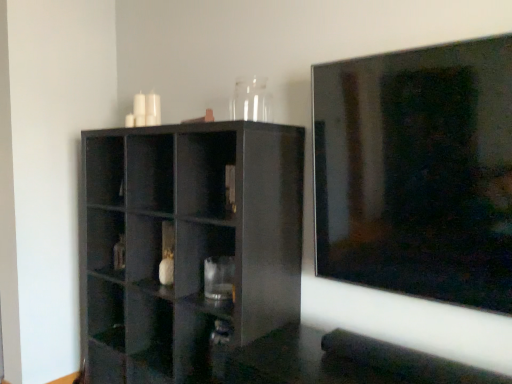
In order to face glossy black shelf at center, should I rotate leftwards or rightwards?

To face it directly, rotate left by 10.112 degrees.

The width and height of the screenshot is (512, 384). Find the location of `glossy black shelf at center`. glossy black shelf at center is located at coordinates (187, 245).

The image size is (512, 384). Describe the element at coordinates (187, 245) in the screenshot. I see `glossy black shelf at center` at that location.

This screenshot has width=512, height=384. In order to click on transparent glass vase at upper center in this screenshot , I will do `click(251, 100)`.

Based on the photo, what is the approximate height of transparent glass vase at upper center?

The height of transparent glass vase at upper center is 7.28 inches.

What do you see at coordinates (251, 100) in the screenshot? Image resolution: width=512 pixels, height=384 pixels. I see `transparent glass vase at upper center` at bounding box center [251, 100].

The image size is (512, 384). Find the location of `glossy black shelf at center`. glossy black shelf at center is located at coordinates coord(187,245).

Is transparent glass vase at upper center at the right side of glossy black shelf at center?

Yes, transparent glass vase at upper center is to the right of glossy black shelf at center.

Is the position of transparent glass vase at upper center more distant than that of glossy black shelf at center?

Yes, the depth of transparent glass vase at upper center is greater than that of glossy black shelf at center.

Is point (244, 89) more distant than point (129, 286)?

No, (244, 89) is closer to viewer.

From the image's perspective, which is above, transparent glass vase at upper center or glossy black shelf at center?

transparent glass vase at upper center appears higher in the image.

From a real-world perspective, is transparent glass vase at upper center physically located above or below glossy black shelf at center?

transparent glass vase at upper center is situated higher than glossy black shelf at center in the real world.

Considering the relative sizes of transparent glass vase at upper center and glossy black shelf at center in the image provided, is transparent glass vase at upper center thinner than glossy black shelf at center?

Correct, the width of transparent glass vase at upper center is less than that of glossy black shelf at center.

In the scene shown: Considering the sizes of objects transparent glass vase at upper center and glossy black shelf at center in the image provided, who is taller, transparent glass vase at upper center or glossy black shelf at center?

glossy black shelf at center.

Which of these two, transparent glass vase at upper center or glossy black shelf at center, is smaller?

transparent glass vase at upper center.

Would you say transparent glass vase at upper center is inside or outside glossy black shelf at center?

transparent glass vase at upper center is not inside glossy black shelf at center, it's outside.

Is transparent glass vase at upper center far away from glossy black shelf at center?

No, there isn't a large distance between transparent glass vase at upper center and glossy black shelf at center.

Is transparent glass vase at upper center positioned with its back to glossy black shelf at center?

No, transparent glass vase at upper center is not facing away from glossy black shelf at center.

Locate an element on the screen. shelf lying in front of the transparent glass vase at upper center is located at coordinates (187, 245).

Is glossy black shelf at center at the left side of transparent glass vase at upper center?

Indeed, glossy black shelf at center is positioned on the left side of transparent glass vase at upper center.

Which object is closer to the camera, glossy black shelf at center or transparent glass vase at upper center?

glossy black shelf at center is closer to the camera.

Which is nearer, (224,137) or (262,82)?

The point (224,137) is in front.

From the image's perspective, who appears lower, glossy black shelf at center or transparent glass vase at upper center?

glossy black shelf at center appears lower in the image.

From a real-world perspective, is glossy black shelf at center positioned above or below transparent glass vase at upper center?

glossy black shelf at center is below transparent glass vase at upper center.

Considering the relative sizes of glossy black shelf at center and transparent glass vase at upper center in the image provided, is glossy black shelf at center thinner than transparent glass vase at upper center?

No, glossy black shelf at center is not thinner than transparent glass vase at upper center.

Does glossy black shelf at center have a lesser height compared to transparent glass vase at upper center?

No, glossy black shelf at center is not shorter than transparent glass vase at upper center.

Is glossy black shelf at center bigger than transparent glass vase at upper center?

Indeed, glossy black shelf at center has a larger size compared to transparent glass vase at upper center.

Can transparent glass vase at upper center be found inside glossy black shelf at center?

No, transparent glass vase at upper center is not a part of glossy black shelf at center.

Is glossy black shelf at center directly adjacent to transparent glass vase at upper center?

There is a gap between glossy black shelf at center and transparent glass vase at upper center.

Could you tell me if glossy black shelf at center is turned towards transparent glass vase at upper center?

No, glossy black shelf at center is not oriented towards transparent glass vase at upper center.

Can you tell me how much glossy black shelf at center and transparent glass vase at upper center differ in facing direction?

glossy black shelf at center and transparent glass vase at upper center are facing 3.22 degrees away from each other.

How far apart are glossy black shelf at center and transparent glass vase at upper center?

glossy black shelf at center is 24.74 inches from transparent glass vase at upper center.

You are a GUI agent. You are given a task and a screenshot of the screen. Output one action in this format:
    pyautogui.click(x=<x>, y=<y>)
    Task: Click on the glass vase that appears above the glossy black shelf at center (from the image's perspective)
    
    Given the screenshot: What is the action you would take?
    pyautogui.click(x=251, y=100)

I want to click on shelf beneath the transparent glass vase at upper center (from a real-world perspective), so click(187, 245).

Locate an element on the screen. Image resolution: width=512 pixels, height=384 pixels. glass vase that is above the glossy black shelf at center (from a real-world perspective) is located at coordinates (251, 100).